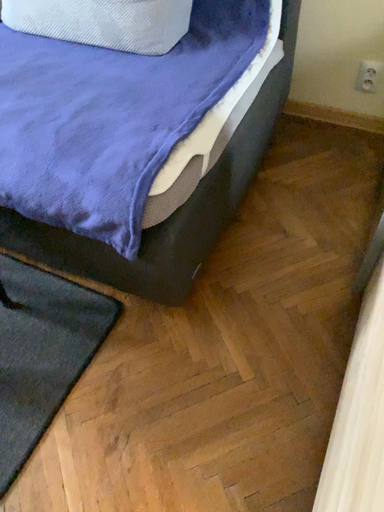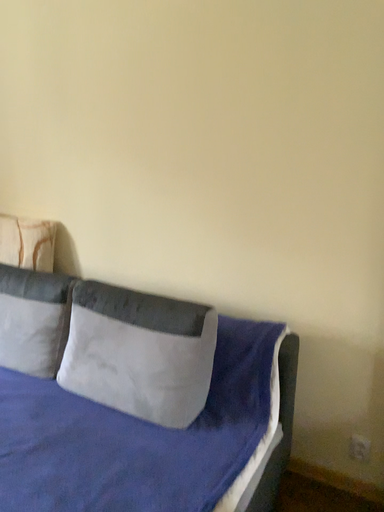
Question: Which way did the camera rotate in the video?

Choices:
 (A) rotated downward
 (B) rotated upward

Answer: (B)